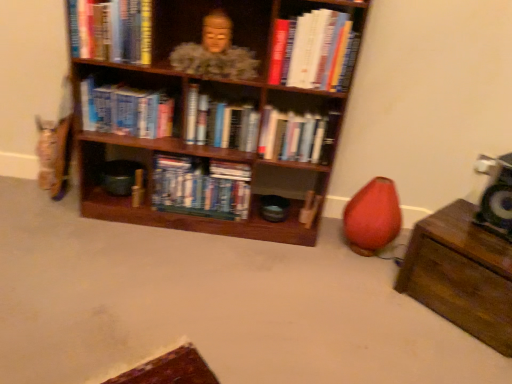
This screenshot has width=512, height=384. What are the coordinates of `free space between wooden bookshelf at center and matte pink bean bag chair at lower right` in the screenshot? It's located at (279, 242).